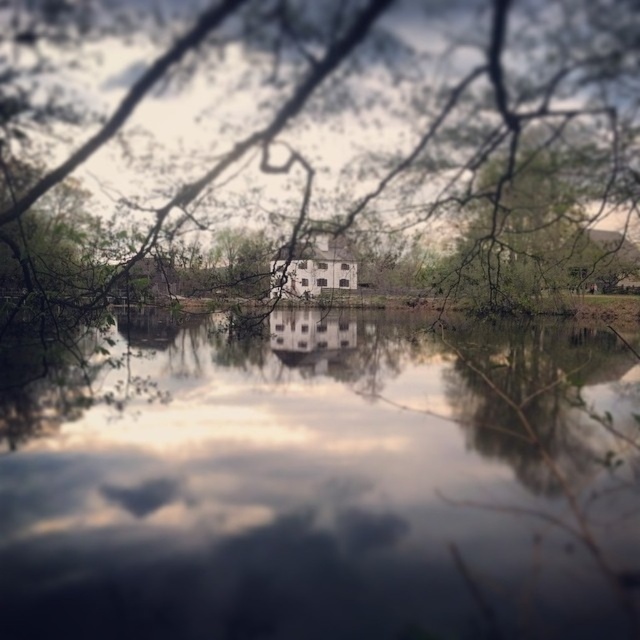
Measure the distance between transparent glass water at center and camera.

The distance of transparent glass water at center from camera is 5.62 meters.

Locate an element on the screen. transparent glass water at center is located at coordinates (332, 484).

What do you see at coordinates (332, 484) in the screenshot? I see `transparent glass water at center` at bounding box center [332, 484].

The image size is (640, 640). What are the coordinates of `transparent glass water at center` in the screenshot? It's located at (332, 484).